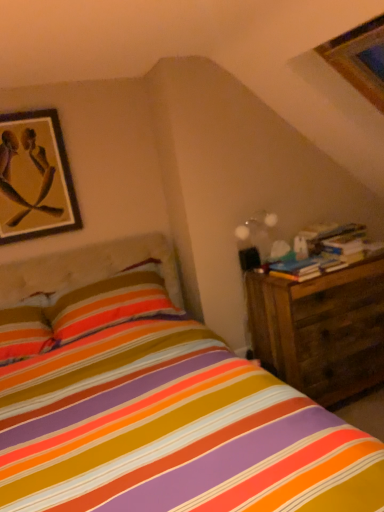
Question: Would you say wooden nightstand at right is outside wooden framed artwork at upper left?

Choices:
 (A) no
 (B) yes

Answer: (B)

Question: Is wooden nightstand at right at the right side of wooden framed artwork at upper left?

Choices:
 (A) no
 (B) yes

Answer: (B)

Question: Is wooden nightstand at right bigger than wooden framed artwork at upper left?

Choices:
 (A) no
 (B) yes

Answer: (B)

Question: From the image's perspective, is wooden nightstand at right located above wooden framed artwork at upper left?

Choices:
 (A) yes
 (B) no

Answer: (B)

Question: Is wooden nightstand at right positioned with its back to wooden framed artwork at upper left?

Choices:
 (A) no
 (B) yes

Answer: (A)

Question: Considering the positions of point (377, 381) and point (51, 172), is point (377, 381) closer or farther from the camera than point (51, 172)?

Choices:
 (A) farther
 (B) closer

Answer: (A)

Question: In terms of height, does wooden nightstand at right look taller or shorter compared to wooden framed artwork at upper left?

Choices:
 (A) short
 (B) tall

Answer: (B)

Question: From a real-world perspective, relative to wooden framed artwork at upper left, is wooden nightstand at right vertically above or below?

Choices:
 (A) below
 (B) above

Answer: (A)

Question: From the image's perspective, is wooden nightstand at right located above or below wooden framed artwork at upper left?

Choices:
 (A) above
 (B) below

Answer: (B)

Question: From a real-world perspective, is wooden framed artwork at upper left positioned above or below wooden nightstand at right?

Choices:
 (A) above
 (B) below

Answer: (A)

Question: Considering the positions of wooden framed artwork at upper left and wooden nightstand at right in the image, is wooden framed artwork at upper left bigger or smaller than wooden nightstand at right?

Choices:
 (A) big
 (B) small

Answer: (B)

Question: In the image, is wooden framed artwork at upper left positioned in front of or behind wooden nightstand at right?

Choices:
 (A) behind
 (B) front

Answer: (A)

Question: Looking at their shapes, would you say wooden framed artwork at upper left is wider or thinner than wooden nightstand at right?

Choices:
 (A) wide
 (B) thin

Answer: (B)

Question: Is translucent glass globe at upper right to the left or to the right of wooden nightstand at right in the image?

Choices:
 (A) left
 (B) right

Answer: (A)

Question: Is point (263, 224) positioned closer to the camera than point (249, 298)?

Choices:
 (A) closer
 (B) farther

Answer: (B)